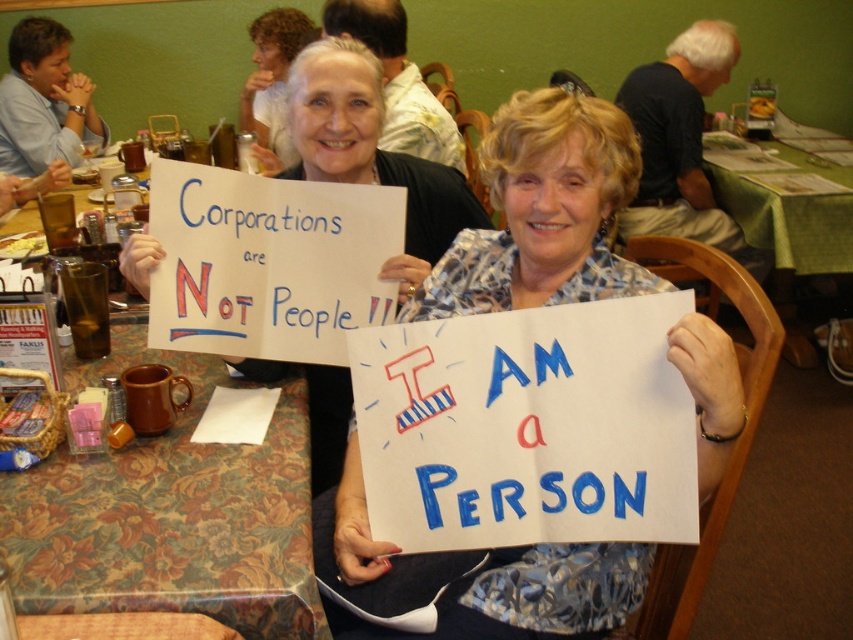
Between floral-patterned tablecloth at lower left and green fabric table at center, which one has less height?

With less height is floral-patterned tablecloth at lower left.

Is floral-patterned tablecloth at lower left above green fabric table at center?

Incorrect, floral-patterned tablecloth at lower left is not positioned above green fabric table at center.

Is point (62, 532) closer to viewer compared to point (828, 161)?

Yes.

Identify the location of floral-patterned tablecloth at lower left. This screenshot has width=853, height=640. (170, 515).

Does point (728, 426) come farther from viewer compared to point (294, 413)?

No, (728, 426) is closer to viewer.

Can you confirm if white paper sign at center is positioned below floral-patterned tablecloth at lower left?

No, white paper sign at center is not below floral-patterned tablecloth at lower left.

Which is behind, point (610, 604) or point (7, 497)?

The point (610, 604) is behind.

Identify the location of white paper sign at center. (543, 211).

Between white paper at upper center and green fabric table at center, which one has less height?

Standing shorter between the two is white paper at upper center.

Who is more distant from viewer, (x=345, y=173) or (x=817, y=198)?

The point (x=817, y=198) is behind.

The image size is (853, 640). Identify the location of white paper at upper center. (372, 154).